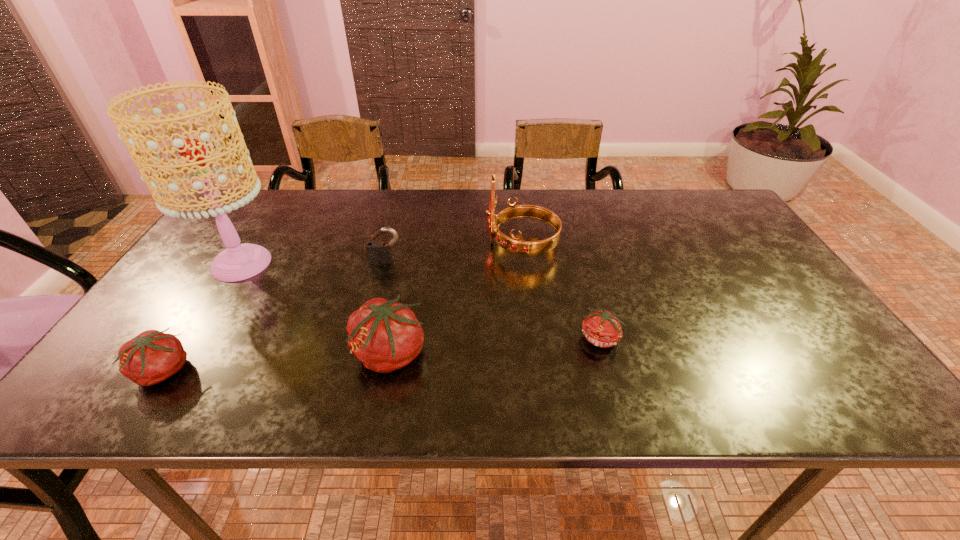
Find the location of `vacant space located on the left of the second tomato from left to right`. vacant space located on the left of the second tomato from left to right is located at coordinates (252, 354).

This screenshot has height=540, width=960. What are the coordinates of `vacant space located 0.200m on the right of the shortest tomato` in the screenshot? It's located at (711, 339).

At what (x,y) coordinates should I click in order to perform the action: click on vacant space located 0.340m on the front-facing side of the tiara. Please return your answer as a coordinate pair (x, y). The width and height of the screenshot is (960, 540). Looking at the image, I should click on (368, 245).

Locate an element on the screen. Image resolution: width=960 pixels, height=540 pixels. free point located on the front-facing side of the tiara is located at coordinates (353, 245).

The height and width of the screenshot is (540, 960). What are the coordinates of `vacant region located on the front-facing side of the tiara` in the screenshot? It's located at (374, 245).

The height and width of the screenshot is (540, 960). I want to click on blank space located 0.210m on the front of the lampshade, so click(181, 356).

Where is `free space located with the keyhole on the front of the fourth tallest object`? free space located with the keyhole on the front of the fourth tallest object is located at coordinates (359, 368).

Locate an element on the screen. object present at the far edge is located at coordinates (514, 245).

Locate an element on the screen. The image size is (960, 540). tomato that is at the left edge is located at coordinates (151, 357).

What are the coordinates of `lampshade positioned at the left edge` in the screenshot? It's located at (238, 262).